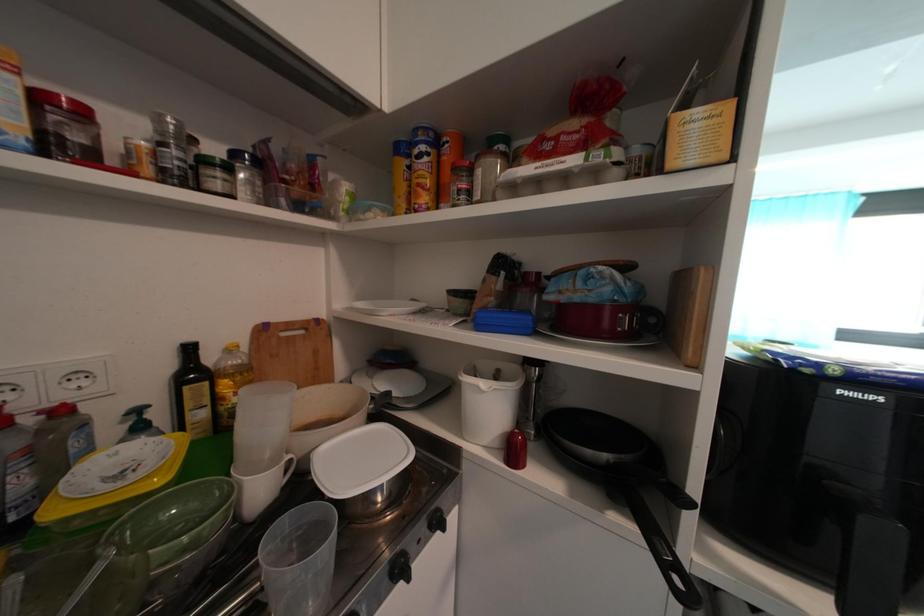
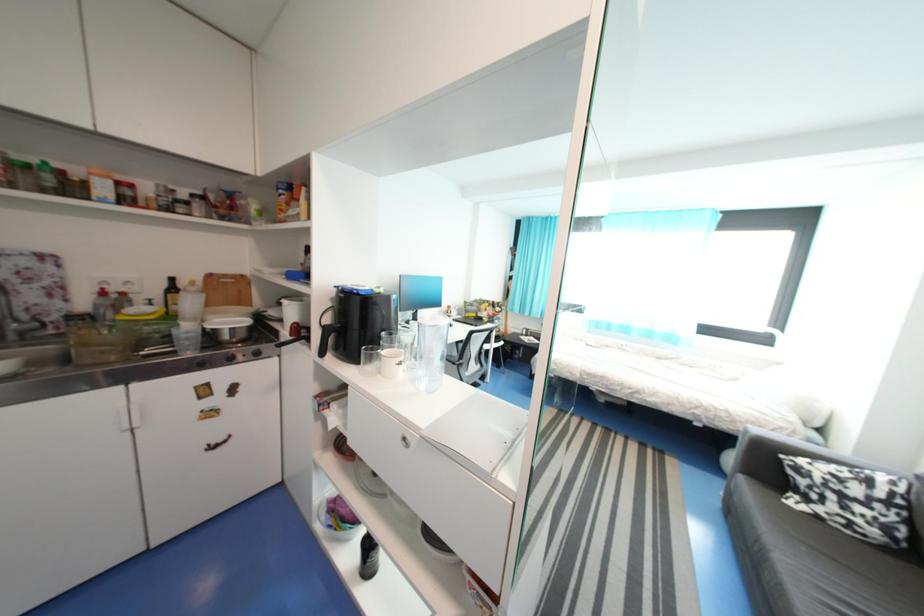
Which direction would the cameraman need to move to produce the second image?

The cameraman moved toward right, backward.